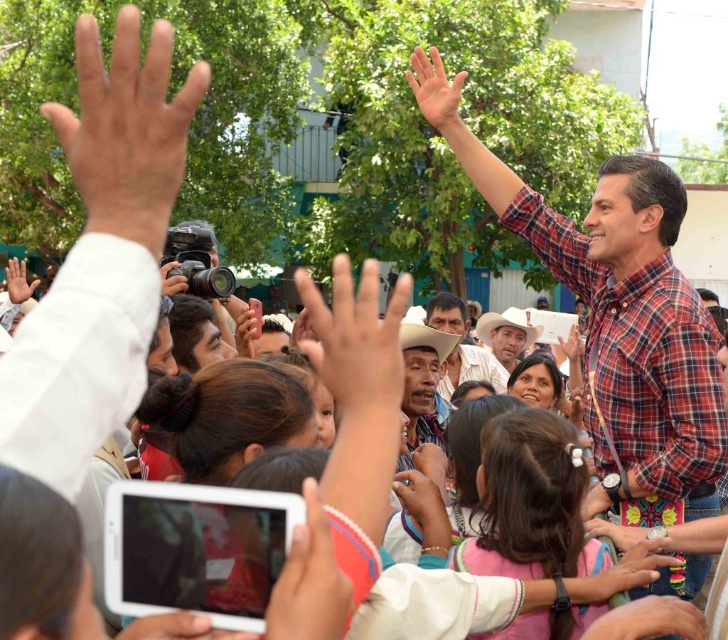
Is white matte tablet at center to the left of smooth skin hand at center from the viewer's perspective?

Indeed, white matte tablet at center is positioned on the left side of smooth skin hand at center.

Between white matte tablet at center and smooth skin hand at center, which one has more height?

white matte tablet at center

The image size is (728, 640). I want to click on white matte tablet at center, so click(309, 580).

What are the coordinates of `white matte tablet at center` in the screenshot? It's located at (309, 580).

Who is taller, multicolored fabric hand at center or matte white hand at upper left?

Standing taller between the two is matte white hand at upper left.

Is multicolored fabric hand at center bigger than matte white hand at upper left?

No, multicolored fabric hand at center is not bigger than matte white hand at upper left.

Who is more forward, (622, 589) or (20, 266)?

Point (622, 589) is in front.

Where is `multicolored fabric hand at center`? The height and width of the screenshot is (640, 728). multicolored fabric hand at center is located at coordinates (644, 566).

Looking at this image, is smooth white hand at center taller than multicolored fabric hand at center?

No.

Is smooth white hand at center shorter than multicolored fabric hand at center?

Indeed, smooth white hand at center has a lesser height compared to multicolored fabric hand at center.

Is point (673, 628) positioned after point (678, 557)?

No, it is in front of (678, 557).

The width and height of the screenshot is (728, 640). In order to click on smooth white hand at center in this screenshot , I will do `click(648, 620)`.